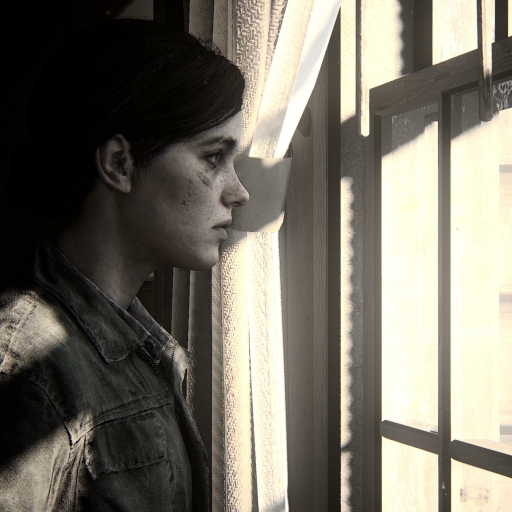
You are a GUI agent. You are given a task and a screenshot of the screen. Output one action in this format:
    pyautogui.click(x=<x>, y=<y>)
    Task: Click on the windows
    
    Given the screenshot: What is the action you would take?
    pyautogui.click(x=439, y=364), pyautogui.click(x=457, y=17)